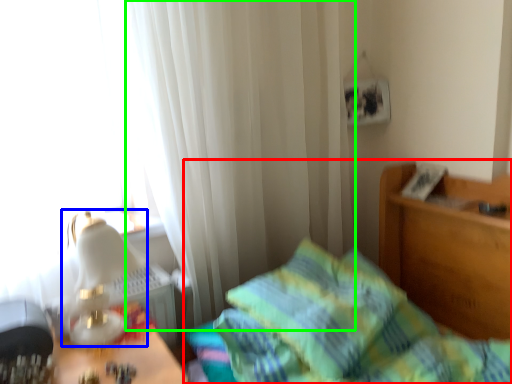
Question: Which object is positioned closest to bed (highlighted by a red box)? Select from table lamp (highlighted by a blue box) and curtain (highlighted by a green box).

Choices:
 (A) table lamp
 (B) curtain

Answer: (B)